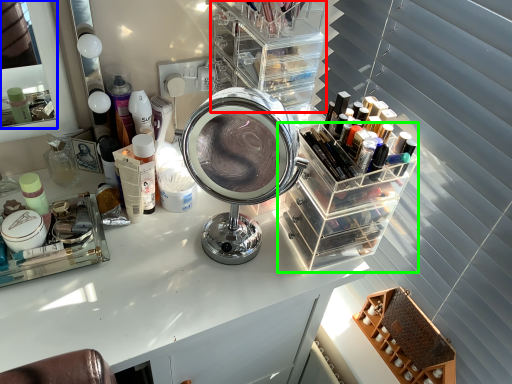
Question: Which is farther away from shelf (highlighted by a red box)? mirror (highlighted by a blue box) or glass box (highlighted by a green box)?

Choices:
 (A) mirror
 (B) glass box

Answer: (A)